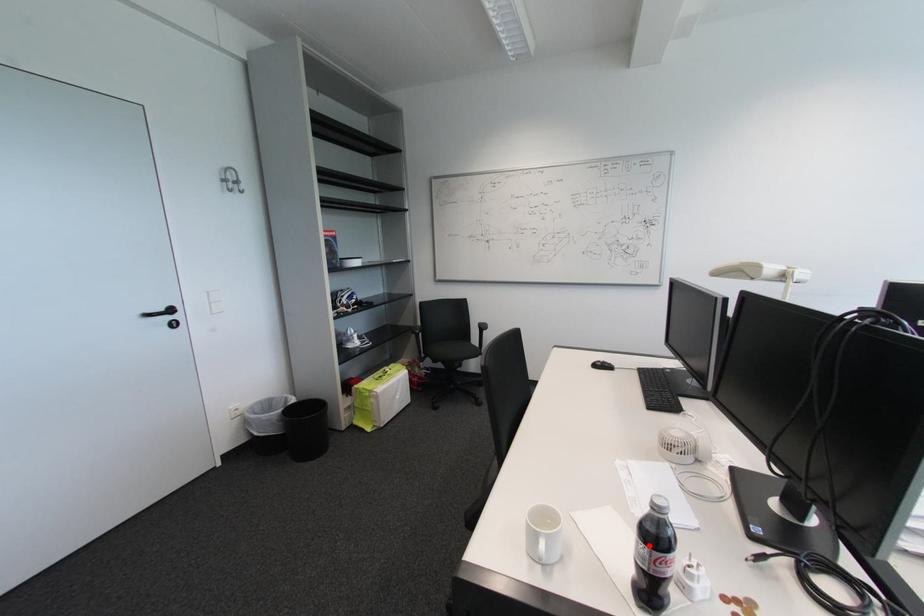
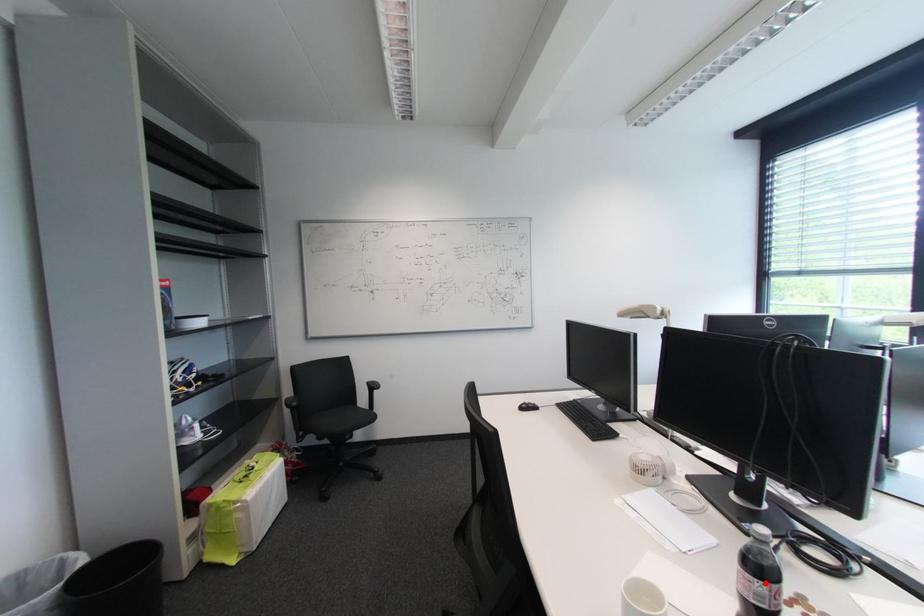
I am providing you with two images of the same scene from different viewpoints. A red point is marked on the first image and another point is marked on the second image. Is the marked point in image1 the same physical position as the marked point in image2?

Yes